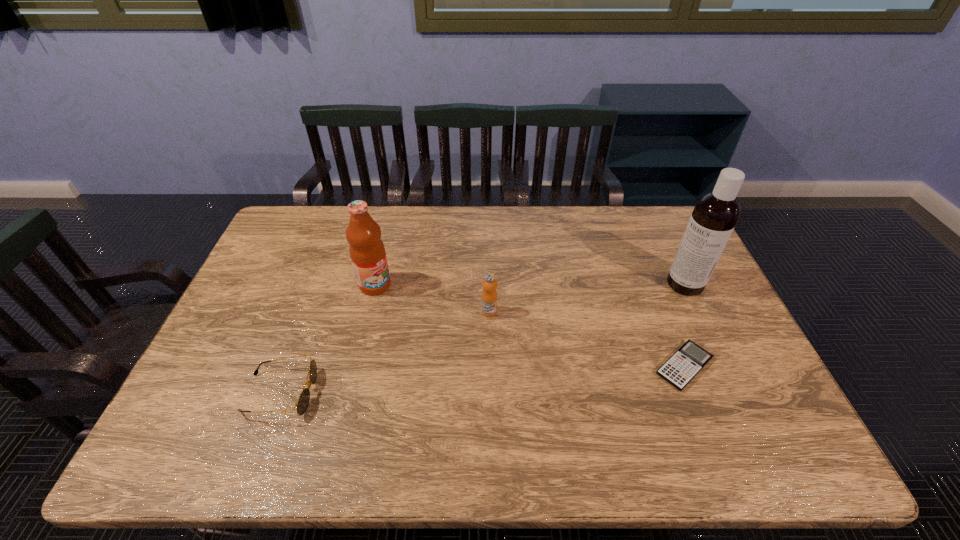
Identify the location of empty space between the second object from left to right and the sunglasses. The image size is (960, 540). (327, 339).

The image size is (960, 540). I want to click on vacant area between the fruit juice and the shortest object, so click(530, 326).

Select which object appears as the fourth closest to the second tallest object. Please provide its 2D coordinates. Your answer should be formatted as a tuple, i.e. [(x, y)], where the tuple contains the x and y coordinates of a point satisfying the conditions above.

[(715, 214)]

Find the location of `the closest object to the tallest object`. the closest object to the tallest object is located at coordinates (690, 359).